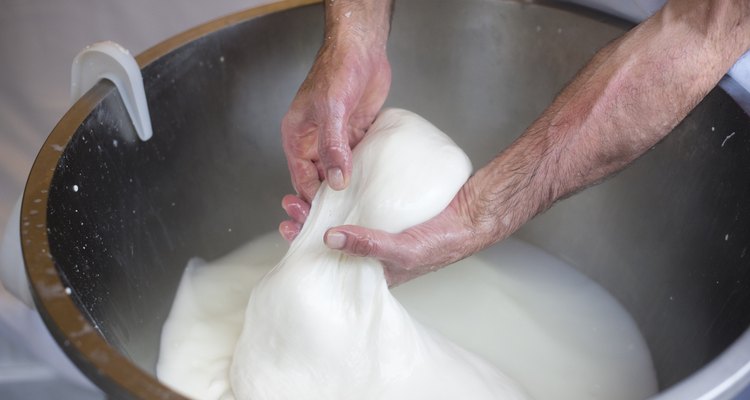
This screenshot has width=750, height=400. I want to click on brown ring on bowl, so click(61, 306).